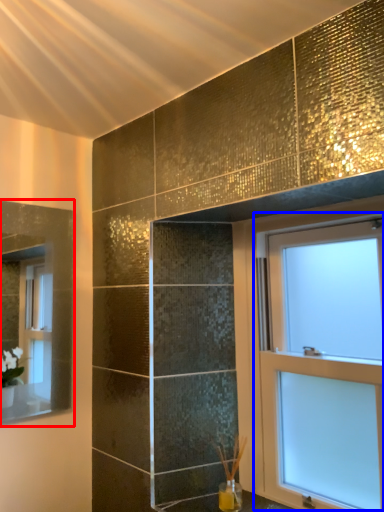
Question: Which object is further to the camera taking this photo, mirror (highlighted by a red box) or window (highlighted by a blue box)?

Choices:
 (A) mirror
 (B) window

Answer: (A)